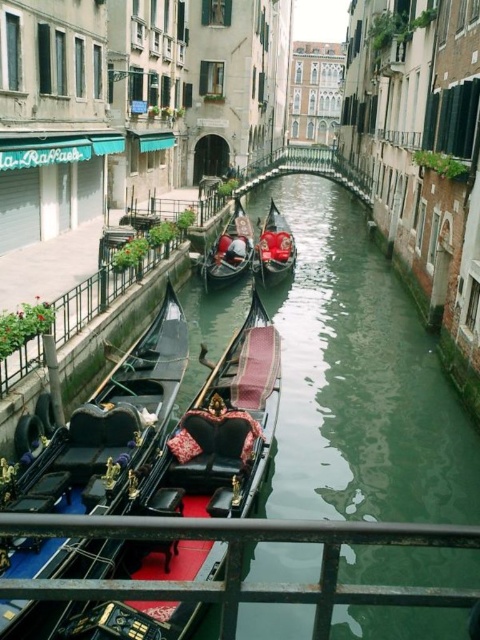
You are a tour guide leading a group of visitors along the canal. You want to inform them about the distance between the green smooth water at center and the polished wood gondola at center. What would you tell them?

The green smooth water at center and the polished wood gondola at center are 13.50 meters apart.

You are standing on the dock near the canal and want to board a gondola. There are two gondolas available, the polished wood gondola at center and the shiny red gondola at center. If you can only walk 40 meters along the dock, which gondola can you reach first?

The polished wood gondola at center is 39.82 meters from the shiny red gondola at center. Since you can walk 40 meters, you can reach both gondolas. However, since the polished wood gondola at center is closer to your starting position, you will reach it first.

From the picture: You are a tour guide leading a group along the canal. You need to fit both the polished wood gondola at center and the shiny red gondola at center into a storage area that can only accommodate the narrower of the two. Which gondola should you choose to store first?

The shiny red gondola at center is narrower than the polished wood gondola at center, so you should store the shiny red gondola at center first since it is the narrower one that fits the storage area.